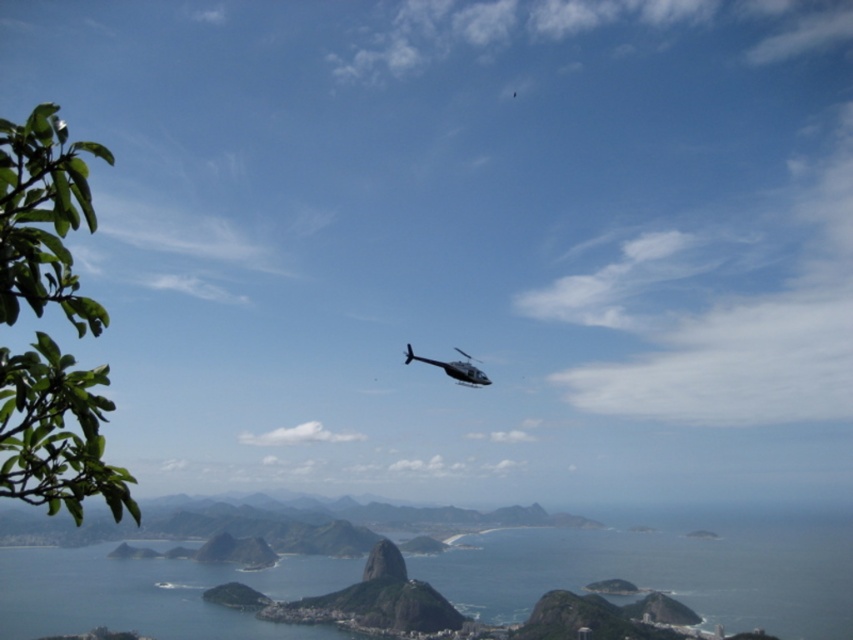
You are a drone operator trying to capture a photo of the metallic silver helicopter at center and the blue water at center. Based on the scene, which object is wider in the image?

The blue water at center might be wider than the metallic silver helicopter at center according to the description provided.